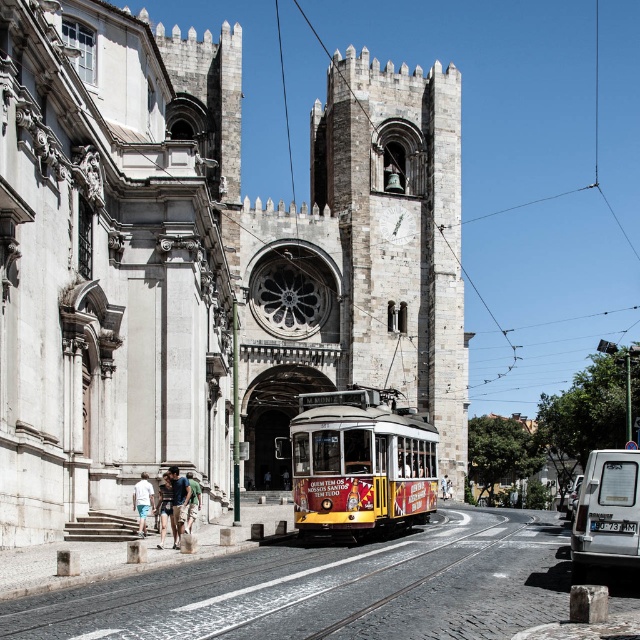
You are a tourist standing in front of the cathedral and want to take a photo of the cathedral without any vehicles blocking the view. You see the white matte van at lower right and the silver metallic van at lower right. Which van should you move to ensure the cathedral is fully visible?

The white matte van at lower right has a lesser width compared to the silver metallic van at lower right, so moving the white matte van at lower right would be more effective in clearing the view of the cathedral since it is narrower and takes up less space.

You are standing on the street in front of the cathedral and want to take a photo that includes both the point at coordinates point [358,253] and point [588,518]. Since you want both points to be in focus, you need to know which point is closer to you. Which point is closer?

Point [588,518] is closer to you because it is less further to the camera than point [358,253].

You are a tourist standing in front of the cathedral and want to take a photo of the cathedral without any vehicles blocking the view. The white matte van at lower right and the silver metallic van at lower right are parked nearby. Which van should you move to ensure the cathedral is fully visible?

The white matte van at lower right occupies less space than the silver metallic van at lower right, so moving the silver metallic van at lower right would be more effective in clearing the view of the cathedral since it takes up more space.